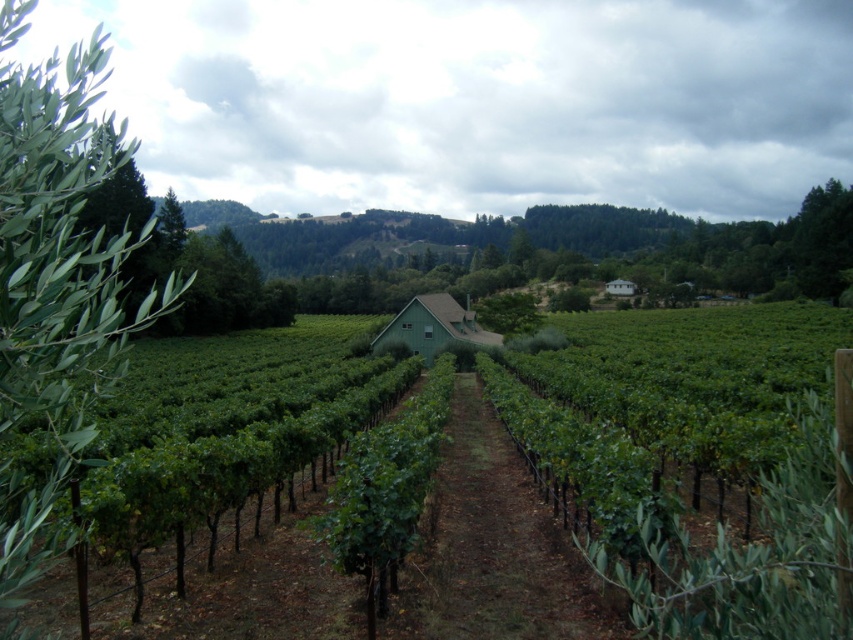
You are standing at the point with coordinates point [79,51] and want to walk to the point with coordinates point [223,586]. According to the scene, will you have to walk through any obstacles like the olive tree or the light green building?

Point [223,586] is in front of point [79,51], so you will not have to walk through any obstacles like the olive tree or the light green building.

You are standing at the origin point of the image. Where is the green matte vineyard at center located in terms of coordinates?

The green matte vineyard at center is located at coordinates point (218, 570).

You are standing at the point marked by the coordinates point (218, 570) in the vineyard. What is the immediate environment around you like?

The point (218, 570) marks the green matte vineyard at center, so the immediate environment around you is surrounded by neatly arranged rows of green grapevines supported by stakes and wires in the vineyard.